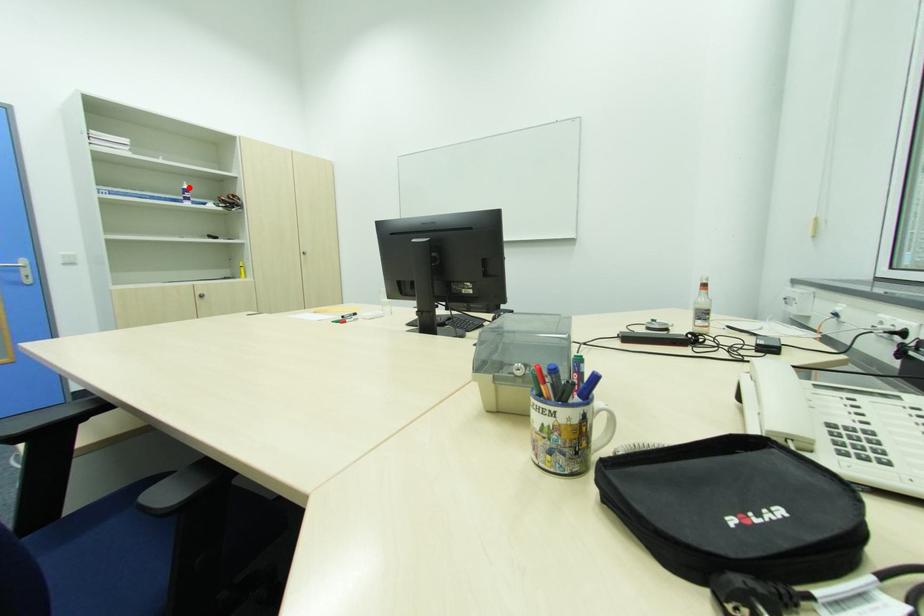
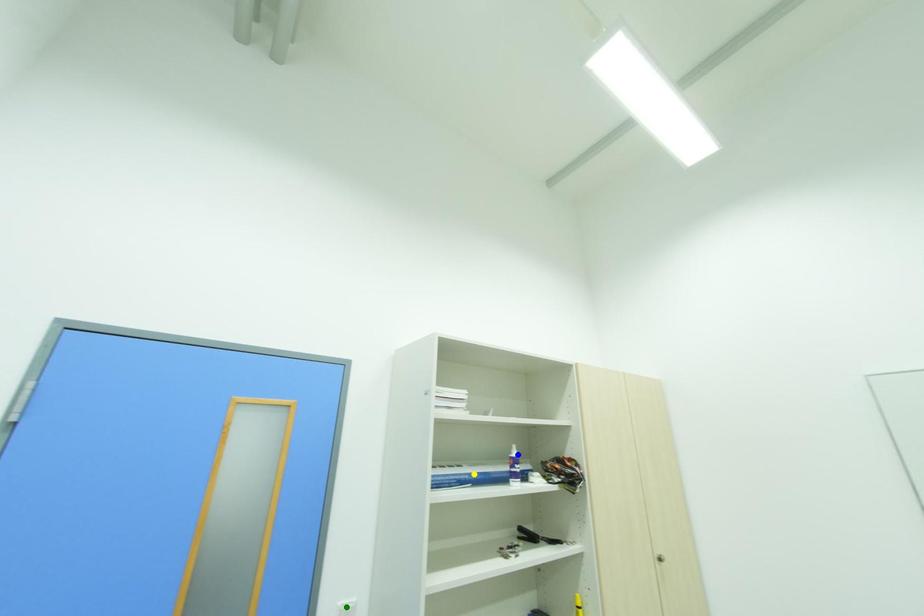
Question: I am providing you with two images of the same scene from different viewpoints. A red point is marked on the first image. You are given multiple points on the second image. Which spot in image 2 lines up with the point in image 1?

Choices:
 (A) yellow point
 (B) green point
 (C) blue point

Answer: (C)